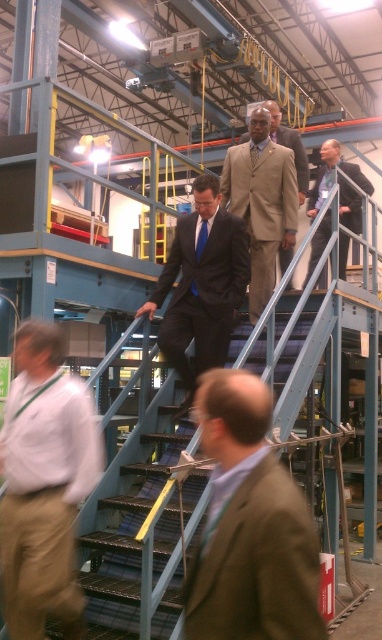
You are standing at the base of the staircase in the industrial facility. There are two points marked on the staircase railings. One is at point coordinates point (286, 156) and the other is at point coordinates point (197, 243). Which point is closer to you?

Point (286, 156) is closer to you because it is further to the viewer than point (197, 243).

You are standing at the origin point of the coordinate system in the image. You need to locate the beige wool suit at center. Which direction should you move to reach it?

The beige wool suit at center is located at coordinate point 0.327 on the x axis and 0.686 on the y axis. Since you are at the origin, you should move right along the x axis to 0.327 and up along the y axis to 0.686 to reach it.

You are an event planner arranging a photoshoot in this industrial facility. You need to ensure that the brown suit at center and the blue silk tie at center are visible in the shot. Considering their sizes, which one will appear larger in the photo?

The brown suit at center will appear larger in the photo because it has a greater height compared to the blue silk tie at center.